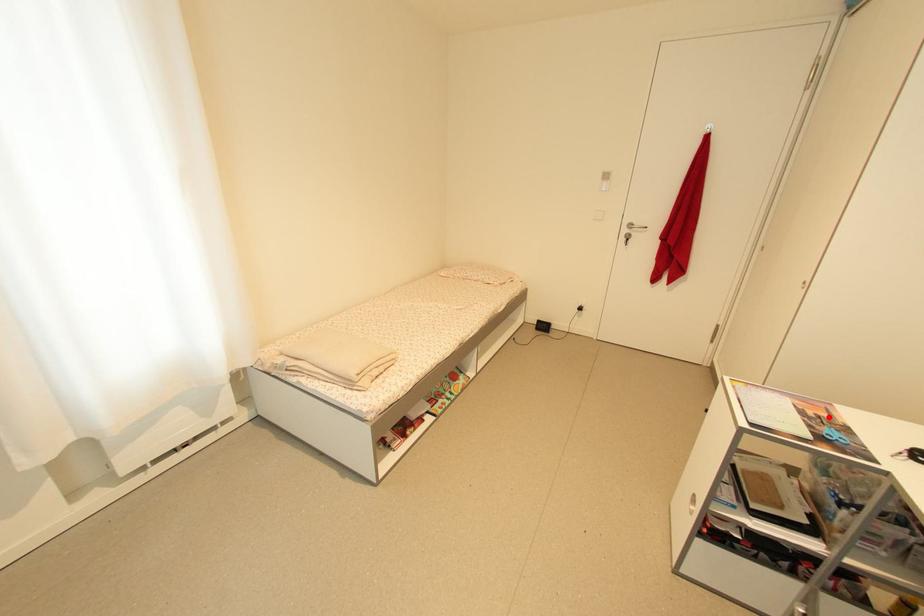
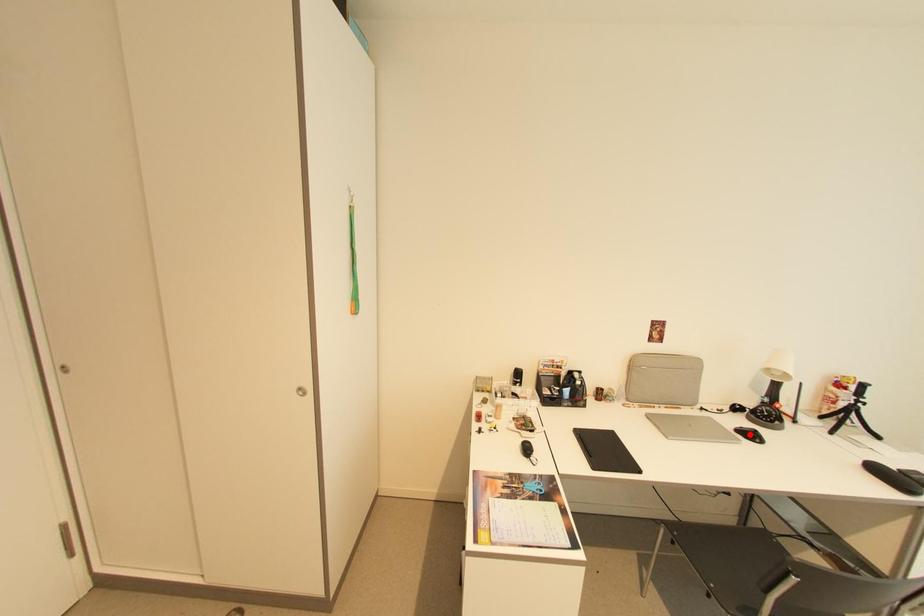
I am providing you with two images of the same scene from different viewpoints. A red point is marked on the first image and another point is marked on the second image. Is the marked point in image1 the same physical position as the marked point in image2?

No